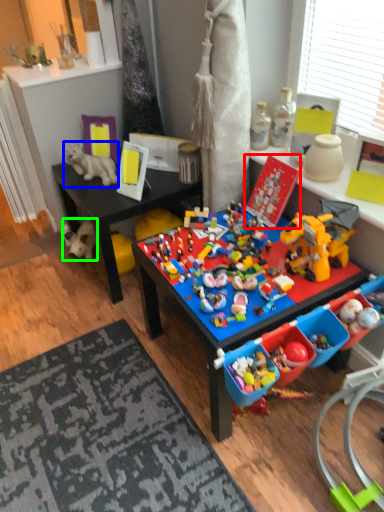
Question: Which is nearer to the toy (highlighted by a red box)? toy (highlighted by a blue box) or toy (highlighted by a green box).

Choices:
 (A) toy
 (B) toy

Answer: (A)